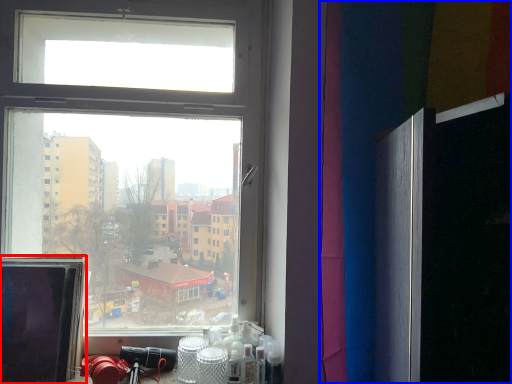
Question: Which object appears farthest to the camera in this image, computer screen (highlighted by a red box) or curtain (highlighted by a blue box)?

Choices:
 (A) computer screen
 (B) curtain

Answer: (A)